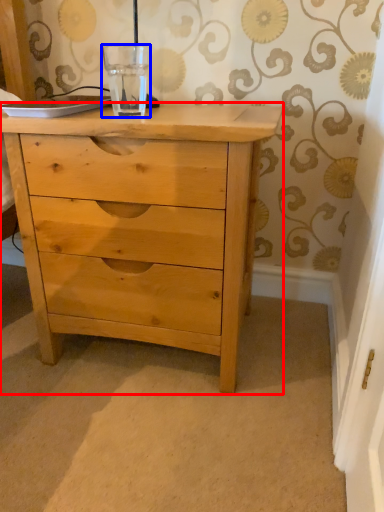
Question: Which object is further to the camera taking this photo, chest of drawers (highlighted by a red box) or glass vase (highlighted by a blue box)?

Choices:
 (A) chest of drawers
 (B) glass vase

Answer: (B)